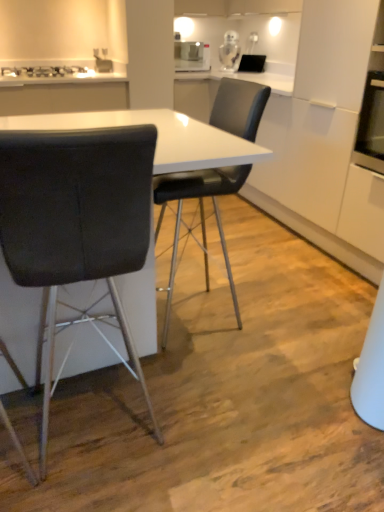
Find the location of `free space in front of black leather chair at center, which is the 1th chair from right to left`. free space in front of black leather chair at center, which is the 1th chair from right to left is located at coordinates tap(252, 379).